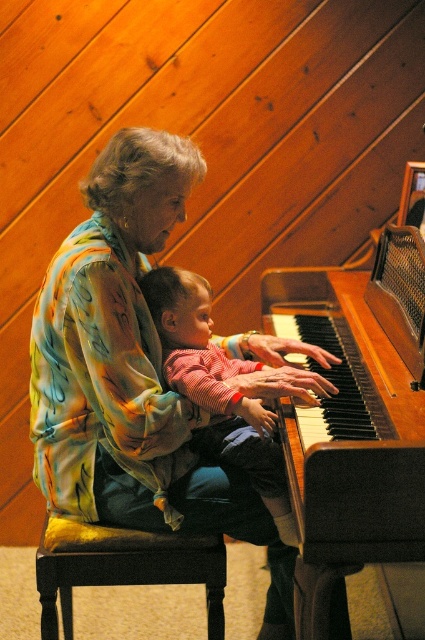
You are standing at the point labeled as point (79, 280) and want to walk to the point labeled as point (122, 560). Which direction should you face to walk straight towards your destination?

Since point (79, 280) is in front of point (122, 560), you should face backward to walk straight towards point (122, 560).